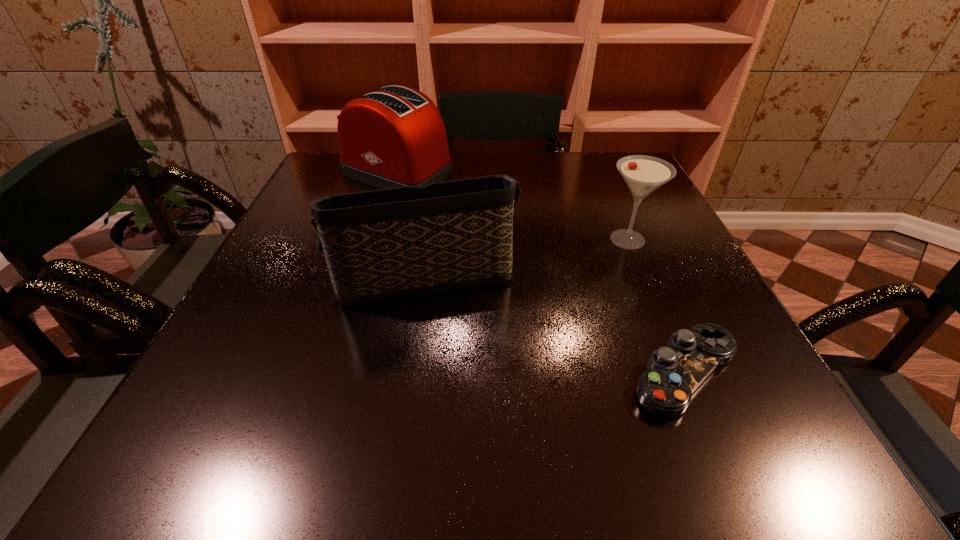
At what (x,y) coordinates should I click in order to perform the action: click on the farthest object. Please return your answer as a coordinate pair (x, y). Looking at the image, I should click on (393, 137).

Locate an element on the screen. Image resolution: width=960 pixels, height=540 pixels. handbag is located at coordinates (385, 244).

Find the location of a particular element. martini is located at coordinates (643, 174).

Find the location of a particular element. control is located at coordinates (674, 372).

Locate an element on the screen. This screenshot has width=960, height=540. the nearest object is located at coordinates (x=674, y=372).

What are the coordinates of `free space located on the right of the farthest object` in the screenshot? It's located at (487, 173).

This screenshot has width=960, height=540. What are the coordinates of `vacant space located 0.120m on the back of the handbag` in the screenshot? It's located at (430, 214).

Identify the location of vacant position located 0.200m on the back of the third tallest object. (603, 181).

Identify the location of vacant area located 0.210m on the back of the nearest object. The height and width of the screenshot is (540, 960). (636, 256).

Where is `object at the far edge`? object at the far edge is located at coordinates (393, 137).